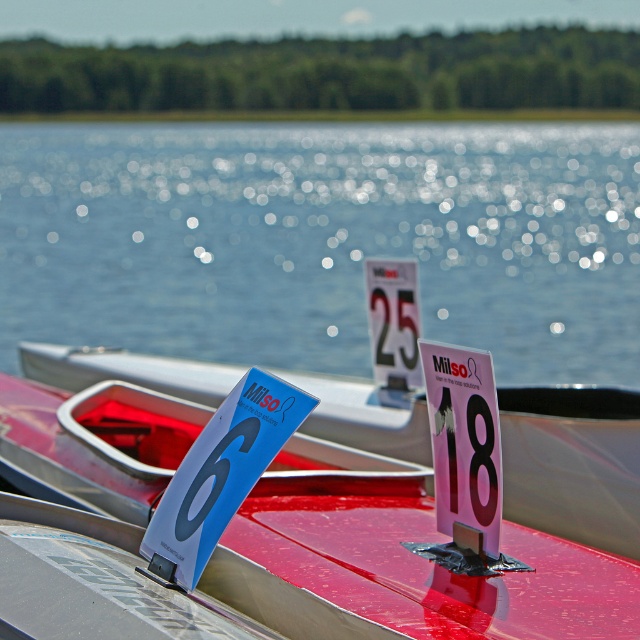
Question: In this image, where is metallic red boat at center located relative to white paper sign at center?

Choices:
 (A) above
 (B) below

Answer: (B)

Question: Among these points, which one is nearest to the camera?

Choices:
 (A) coord(476,400)
 (B) coord(209,508)
 (C) coord(241,189)
 (D) coord(467,504)

Answer: (B)

Question: Can you confirm if white paper sign at center is positioned to the right of pink paper at center?

Choices:
 (A) no
 (B) yes

Answer: (A)

Question: Which object appears closest to the camera in this image?

Choices:
 (A) pink paper at center
 (B) glistening water at center

Answer: (B)

Question: Which object is positioned farthest from the metallic red boat at center?

Choices:
 (A) pink paper at center
 (B) black glossy number at center
 (C) glistening water at center
 (D) blue glossy sign at center

Answer: (C)

Question: Considering the relative positions of glistening water at center and black glossy number at center in the image provided, where is glistening water at center located with respect to black glossy number at center?

Choices:
 (A) right
 (B) left

Answer: (B)